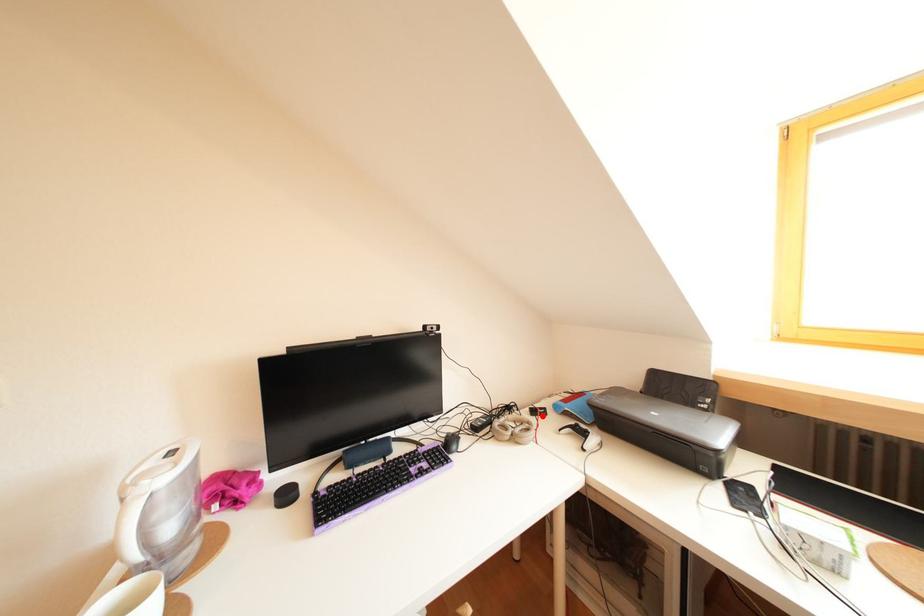
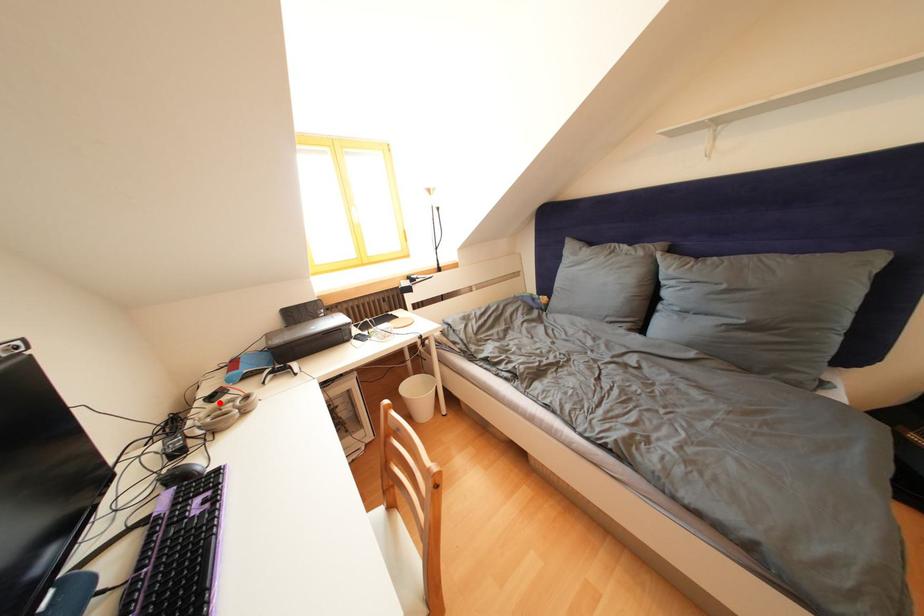
I am providing you with two images of the same scene from different viewpoints. A red point is marked on the first image and another point is marked on the second image. Do the highlighted points in image1 and image2 indicate the same real-world spot?

Yes